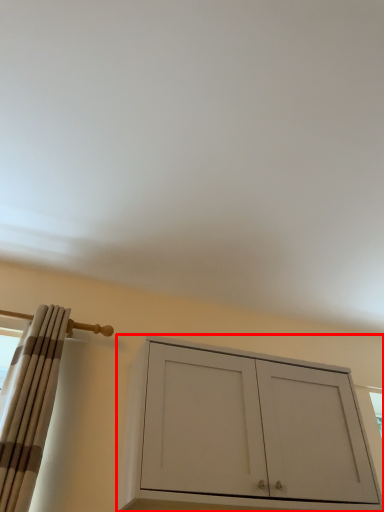
Question: Considering the relative positions of cabinetry (annotated by the red box) and curtain in the image provided, where is cabinetry (annotated by the red box) located with respect to the staircase?

Choices:
 (A) right
 (B) left

Answer: (A)